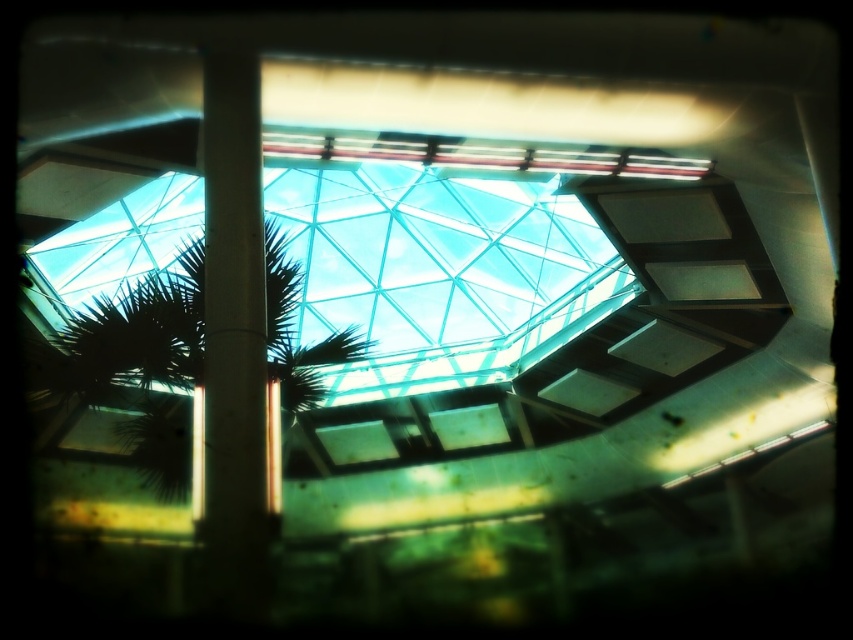
Question: Is green leafy palm tree at center wider than smooth concrete pillar at center?

Choices:
 (A) no
 (B) yes

Answer: (B)

Question: Which point appears closest to the camera in this image?

Choices:
 (A) (265, 294)
 (B) (218, 396)

Answer: (B)

Question: Does green leafy palm tree at center lie in front of smooth concrete pillar at center?

Choices:
 (A) no
 (B) yes

Answer: (A)

Question: Among these points, which one is farthest from the camera?

Choices:
 (A) (189, 388)
 (B) (213, 428)

Answer: (A)

Question: Can you confirm if green leafy palm tree at center is thinner than smooth concrete pillar at center?

Choices:
 (A) no
 (B) yes

Answer: (A)